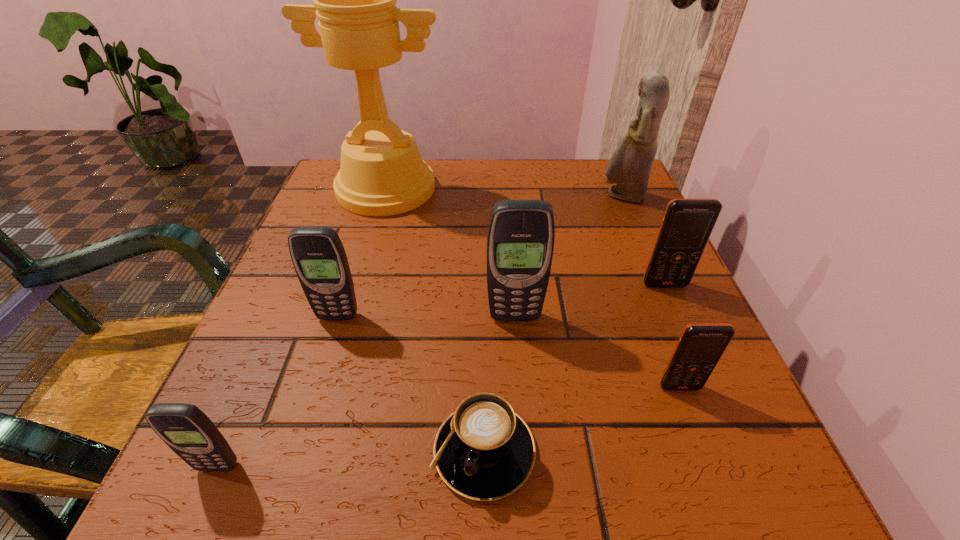
Where is `vacant area situated 0.110m on the screen of the fourth cellular telephone from right to left`? The image size is (960, 540). vacant area situated 0.110m on the screen of the fourth cellular telephone from right to left is located at coordinates (319, 377).

You are a GUI agent. You are given a task and a screenshot of the screen. Output one action in this format:
    pyautogui.click(x=<x>, y=<y>)
    Task: Click on the vacant point located 0.150m on the screen of the farther orange cellular telephone
    This screenshot has width=960, height=540.
    Given the screenshot: What is the action you would take?
    pyautogui.click(x=697, y=357)

Locate an element on the screen. Image resolution: width=960 pixels, height=540 pixels. free point located 0.100m on the screen of the nearer orange cellular telephone is located at coordinates (708, 461).

Where is `free space located on the right of the cappuccino`? The image size is (960, 540). free space located on the right of the cappuccino is located at coordinates [x=737, y=451].

I want to click on award at the far edge, so click(x=382, y=173).

At what (x,y) coordinates should I click in order to perform the action: click on figurine at the far edge. Please return your answer as a coordinate pair (x, y). This screenshot has height=540, width=960. Looking at the image, I should click on (630, 165).

Locate an element on the screen. cellular telephone at the near edge is located at coordinates (189, 432).

At what (x,y) coordinates should I click in order to perform the action: click on cappuccino situated at the near edge. Please return your answer as a coordinate pair (x, y). The height and width of the screenshot is (540, 960). Looking at the image, I should click on (484, 451).

I want to click on award that is at the left edge, so click(382, 173).

This screenshot has height=540, width=960. Identify the location of figurine positioned at the right edge. (630, 165).